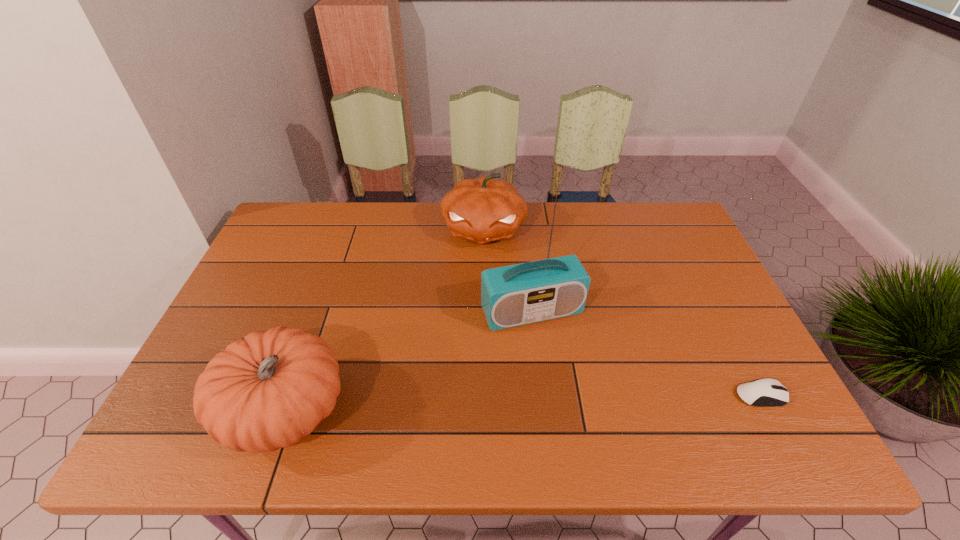
This screenshot has width=960, height=540. What are the coordinates of `object at the right edge` in the screenshot? It's located at (767, 392).

Where is `object that is at the near left corner`? The height and width of the screenshot is (540, 960). object that is at the near left corner is located at coordinates (269, 389).

I want to click on object located at the near right corner, so click(x=767, y=392).

You are a GUI agent. You are given a task and a screenshot of the screen. Output one action in this format:
    pyautogui.click(x=<x>, y=<y>)
    Task: Click on the blank space at the far edge
    
    Given the screenshot: What is the action you would take?
    coord(423,212)

In order to click on free space at the near edge in this screenshot , I will do `click(424, 400)`.

Where is `blank space at the left edge`? The height and width of the screenshot is (540, 960). blank space at the left edge is located at coordinates (279, 285).

Image resolution: width=960 pixels, height=540 pixels. I want to click on blank space at the right edge, so click(x=740, y=329).

You are a GUI agent. You are given a task and a screenshot of the screen. Output one action in this format:
    pyautogui.click(x=<x>, y=<y>)
    Task: Click on the free space at the far right corner of the desktop
    This screenshot has height=540, width=960.
    Given the screenshot: What is the action you would take?
    pyautogui.click(x=667, y=238)

Find the location of a particular element. free space between the nearer pumpkin and the radio receiver is located at coordinates (409, 362).

Locate an element on the screen. free area in between the farthest object and the shortest object is located at coordinates (622, 312).